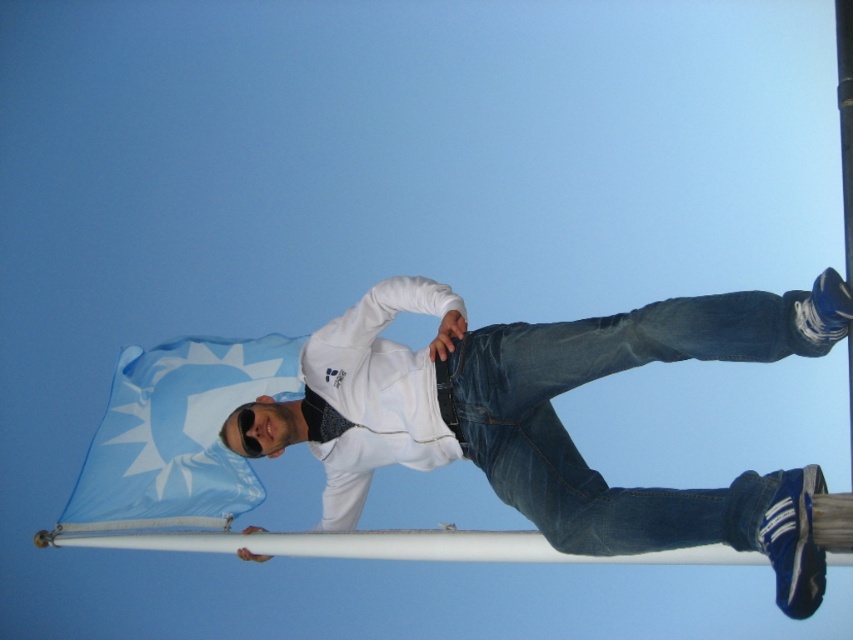
Does denim at center appear on the left side of blue fabric flag at upper left?

In fact, denim at center is to the right of blue fabric flag at upper left.

In the scene shown: Does denim at center have a lesser width compared to blue fabric flag at upper left?

In fact, denim at center might be wider than blue fabric flag at upper left.

Is point (555, 468) less distant than point (206, 380)?

Yes.

The height and width of the screenshot is (640, 853). What are the coordinates of `denim at center` in the screenshot? It's located at (595, 378).

Does point (708, 326) come closer to viewer compared to point (99, 467)?

That is True.

Who is positioned more to the right, white matte hoodie at center or blue fabric flag at upper left?

From the viewer's perspective, white matte hoodie at center appears more on the right side.

Is point (746, 483) farther from camera compared to point (148, 432)?

No, (746, 483) is in front of (148, 432).

Where is `white matte hoodie at center`? The image size is (853, 640). white matte hoodie at center is located at coordinates (549, 417).

Between white matte hoodie at center and denim at center, which one appears on the right side from the viewer's perspective?

Positioned to the right is denim at center.

Can you confirm if white matte hoodie at center is wider than denim at center?

Indeed, white matte hoodie at center has a greater width compared to denim at center.

Identify the location of white matte hoodie at center. (549, 417).